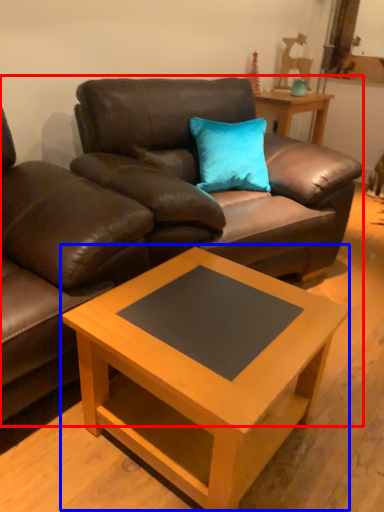
Question: Among these objects, which one is nearest to the camera, studio couch (highlighted by a red box) or coffee table (highlighted by a blue box)?

Choices:
 (A) studio couch
 (B) coffee table

Answer: (B)